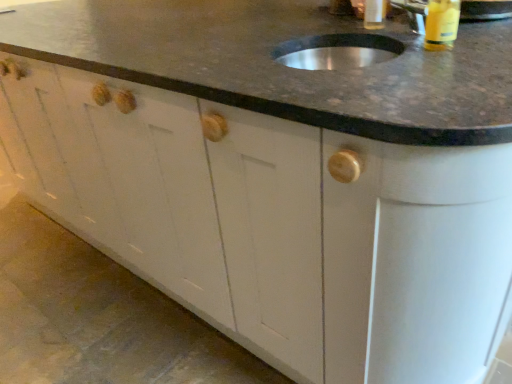
This screenshot has width=512, height=384. Find the location of `vacant space situated on the left part of translucent plastic bottle at upper center, positioned as the 1th beverage in left-to-right order`. vacant space situated on the left part of translucent plastic bottle at upper center, positioned as the 1th beverage in left-to-right order is located at coordinates (297, 21).